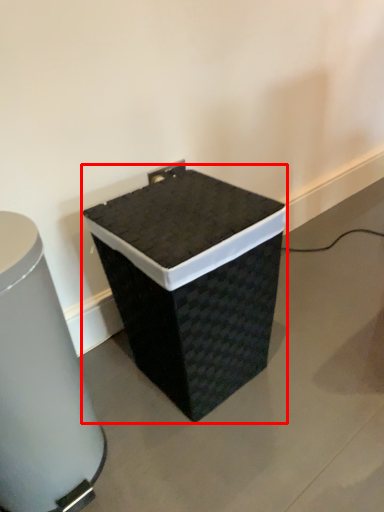
Question: From the image's perspective, what is the correct spatial positioning of waste container (annotated by the red box) in reference to waste container?

Choices:
 (A) below
 (B) above

Answer: (B)